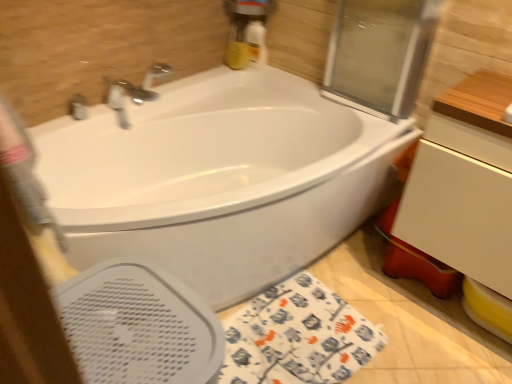
Question: Can you confirm if white perforated bidet at lower left is wider than white matte drawer at right?

Choices:
 (A) yes
 (B) no

Answer: (B)

Question: Does white perforated bidet at lower left have a larger size compared to white matte drawer at right?

Choices:
 (A) yes
 (B) no

Answer: (B)

Question: Is the depth of white perforated bidet at lower left less than that of white matte drawer at right?

Choices:
 (A) yes
 (B) no

Answer: (A)

Question: Is white perforated bidet at lower left placed right next to white matte drawer at right?

Choices:
 (A) no
 (B) yes

Answer: (A)

Question: Is white perforated bidet at lower left located outside white matte drawer at right?

Choices:
 (A) no
 (B) yes

Answer: (B)

Question: Considering the positions of transparent glass screen door at upper right and white perforated bidet at lower left in the image, is transparent glass screen door at upper right taller or shorter than white perforated bidet at lower left?

Choices:
 (A) tall
 (B) short

Answer: (B)

Question: From a real-world perspective, is transparent glass screen door at upper right above or below white perforated bidet at lower left?

Choices:
 (A) above
 (B) below

Answer: (A)

Question: Would you say transparent glass screen door at upper right is inside or outside white perforated bidet at lower left?

Choices:
 (A) outside
 (B) inside

Answer: (A)

Question: Relative to white perforated bidet at lower left, is transparent glass screen door at upper right in front or behind?

Choices:
 (A) behind
 (B) front

Answer: (A)

Question: Is transparent glass screen door at upper right wider or thinner than white matte drawer at right?

Choices:
 (A) thin
 (B) wide

Answer: (A)

Question: In terms of height, does transparent glass screen door at upper right look taller or shorter compared to white matte drawer at right?

Choices:
 (A) tall
 (B) short

Answer: (B)

Question: Considering their positions, is transparent glass screen door at upper right located in front of or behind white matte drawer at right?

Choices:
 (A) behind
 (B) front

Answer: (A)

Question: Is transparent glass screen door at upper right inside or outside of white matte drawer at right?

Choices:
 (A) outside
 (B) inside

Answer: (A)

Question: In terms of width, does matte silver faucet at upper left look wider or thinner when compared to white glossy bathtub at center?

Choices:
 (A) thin
 (B) wide

Answer: (A)

Question: Is matte silver faucet at upper left bigger or smaller than white glossy bathtub at center?

Choices:
 (A) big
 (B) small

Answer: (B)